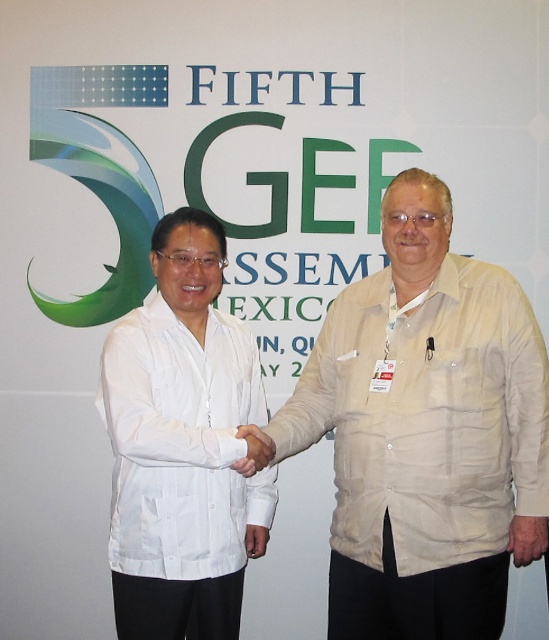
From the picture: You are standing in front of the backdrop and see a point marked at coordinates (425, 432). Based on the scene description, what object or part of the scene is this point likely located on?

The point at (425, 432) is on the beige fabric shirt at center.

You are an event photographer trying to capture a photo of both the beige fabric shirt at center and the white matte shirt at center. Which shirt should you focus on first to ensure it fits within the frame?

Answer: The beige fabric shirt at center has a larger width than the white matte shirt at center, so you should focus on capturing the beige fabric shirt at center first to ensure it fits within the frame.

You are a photographer at an event and want to capture a clear photo of the GEF text on the backdrop. There are two people in front of it wearing beige fabric shirt at center and white matte shirt at center. Which person should you ask to move slightly backward to ensure the GEF text is fully visible?

The beige fabric shirt at center is closer to the camera, so asking them to move back would allow the GEF text to be visible without obstruction.